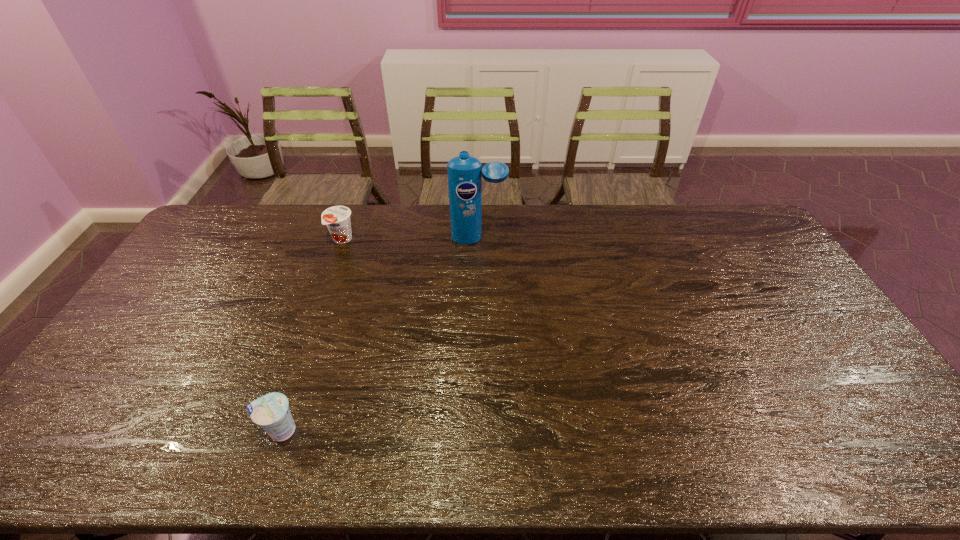
Locate an element on the screen. the rightmost object is located at coordinates (465, 172).

The image size is (960, 540). What are the coordinates of `the tallest object` in the screenshot? It's located at (465, 172).

Locate an element on the screen. This screenshot has height=540, width=960. the farther yogurt is located at coordinates (337, 218).

At what (x,y) coordinates should I click in order to perform the action: click on the nearest object. Please return your answer as a coordinate pair (x, y). The height and width of the screenshot is (540, 960). Looking at the image, I should click on (271, 411).

Where is `free spot located 0.160m on the front of the tallest object`? The image size is (960, 540). free spot located 0.160m on the front of the tallest object is located at coordinates (478, 276).

What are the coordinates of `vacant area situated on the left of the farther yogurt` in the screenshot? It's located at (271, 239).

Find the location of `vacant area situated on the right of the nearest object`. vacant area situated on the right of the nearest object is located at coordinates (440, 430).

Identify the location of shampoo present at the far edge. (465, 172).

The width and height of the screenshot is (960, 540). I want to click on yogurt located at the far edge, so click(x=337, y=218).

Locate an element on the screen. Image resolution: width=960 pixels, height=540 pixels. object at the near edge is located at coordinates (271, 411).